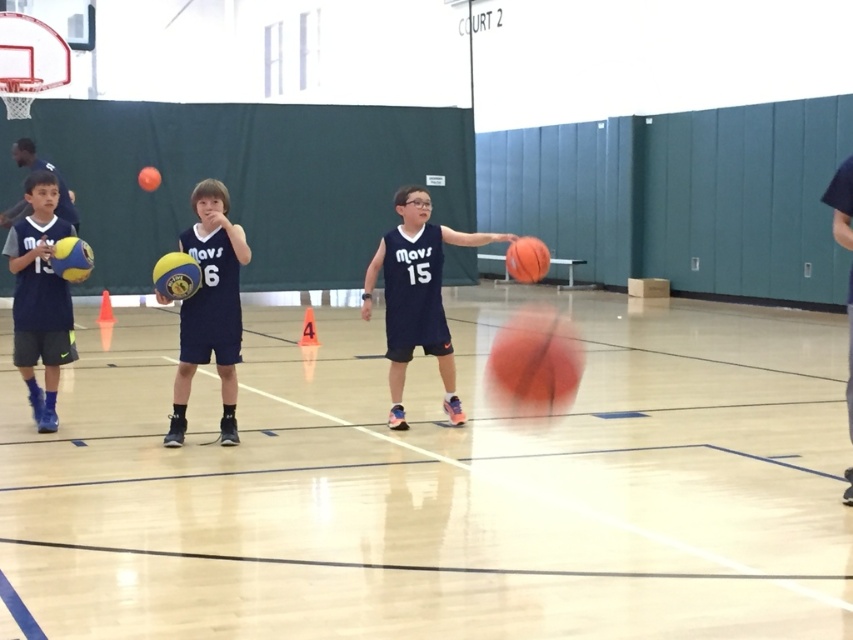
Is matte blue jersey at center bigger than rubber textured basketball at center?

Actually, matte blue jersey at center might be smaller than rubber textured basketball at center.

Does point (207, 273) lie behind point (520, 280)?

No.

The width and height of the screenshot is (853, 640). I want to click on matte blue jersey at center, so 210,307.

Is rubber basketball at center smaller than glossy blue jersey at center?

Yes.

Does rubber basketball at center have a greater width compared to glossy blue jersey at center?

Incorrect, rubber basketball at center's width does not surpass glossy blue jersey at center's.

Where is `rubber basketball at center`? The image size is (853, 640). rubber basketball at center is located at coordinates (210, 307).

Locate an element on the screen. This screenshot has width=853, height=640. rubber basketball at center is located at coordinates (210, 307).

Is matte yellow basketball at left thinner than rubber/synthetic basketball at center?

Indeed, matte yellow basketball at left has a lesser width compared to rubber/synthetic basketball at center.

Who is taller, matte yellow basketball at left or rubber/synthetic basketball at center?

matte yellow basketball at left is taller.

Does point (28, 330) lie in front of point (572, 348)?

Yes.

At what (x,y) coordinates should I click in order to perform the action: click on matte yellow basketball at left. Please return your answer as a coordinate pair (x, y). This screenshot has height=640, width=853. Looking at the image, I should click on (39, 296).